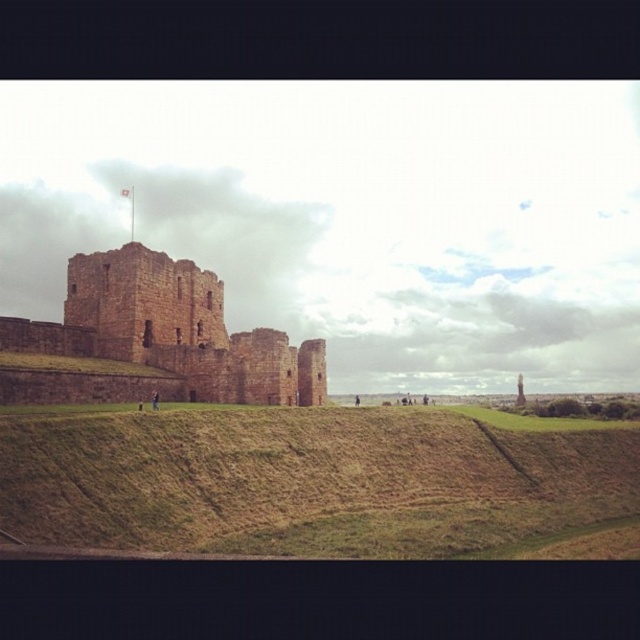
You are a tourist standing at the base of the brown grassy hill at lower center looking up at the brown stone castle at center. Which direction should you walk to reach the castle?

You should walk upward towards the brown stone castle at center since the brown grassy hill at lower center is below it.

You are a hiker standing at the base of the brown grassy hill at lower center, planning to reach the brown stone castle at center. Given that your maximum walking distance is 20 meters, can you reach the castle without exceeding your limit?

The brown grassy hill at lower center is 22.11 meters away from the brown stone castle at center, which exceeds your maximum walking distance of 20 meters. Therefore, you cannot reach the castle without exceeding your limit.

You are standing at the base of the castle and want to reach the flagpole at the top. Which direction should you walk relative to the brown grassy hill at lower center?

You should walk towards the top of the brown grassy hill at lower center to reach the flagpole at the top of the castle.